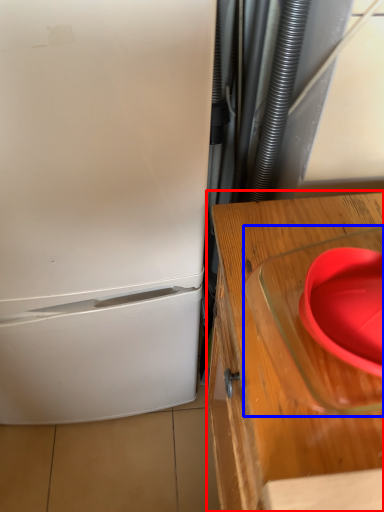
Question: Which of the following is the farthest to the observer, table (highlighted by a red box) or appliance (highlighted by a blue box)?

Choices:
 (A) table
 (B) appliance

Answer: (A)